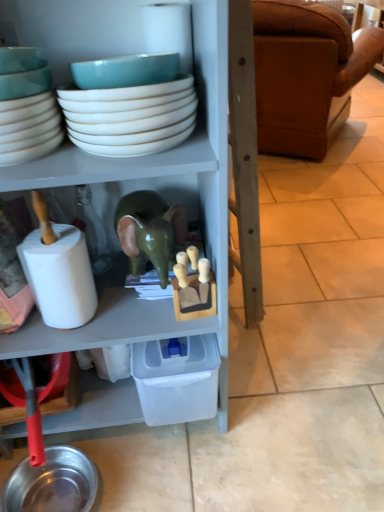
Where is `brown leather couch at right`? brown leather couch at right is located at coordinates (306, 74).

Identify the location of metallic silver bowl at lower left. (52, 483).

What do you see at coordinates (29, 128) in the screenshot? I see `teal ceramic bowl at upper left, marked as the 1th bowl in a left-to-right arrangement` at bounding box center [29, 128].

Where is `teal ceramic bowl at upper left, marked as the 2th bowl in a right-to-left arrangement`? The width and height of the screenshot is (384, 512). teal ceramic bowl at upper left, marked as the 2th bowl in a right-to-left arrangement is located at coordinates (29, 128).

I want to click on green glossy elephant at center, so click(150, 229).

What do you see at coordinates (60, 276) in the screenshot? The image size is (384, 512). I see `white matte toilet paper at left` at bounding box center [60, 276].

The width and height of the screenshot is (384, 512). Identify the location of white glossy bowls at upper center, the 1th bowl when ordered from right to left. 130,117.

Is white matte toilet paper at left wider or thinner than metallic silver bowl at lower left?

Clearly, white matte toilet paper at left has less width compared to metallic silver bowl at lower left.

Does white matte toilet paper at left touch metallic silver bowl at lower left?

white matte toilet paper at left and metallic silver bowl at lower left are clearly separated.

From a real-world perspective, which is physically below, white matte toilet paper at left or metallic silver bowl at lower left?

metallic silver bowl at lower left, from a real-world perspective.

Is green glossy elephant at center turned away from brown leather couch at right?

No, green glossy elephant at center is not facing away from brown leather couch at right.

Would you say green glossy elephant at center is to the left or to the right of brown leather couch at right in the picture?

In the image, green glossy elephant at center appears on the left side of brown leather couch at right.

Is green glossy elephant at center far from brown leather couch at right?

Yes, green glossy elephant at center and brown leather couch at right are located far from each other.

Who is more distant, green glossy elephant at center or brown leather couch at right?

Positioned behind is brown leather couch at right.

From a real-world perspective, who is located lower, white matte toilet paper at left or white glossy bowls at upper center, which is the 2th bowl in left-to-right order?

white matte toilet paper at left is physically lower.

Considering the sizes of objects white matte toilet paper at left and white glossy bowls at upper center, the 1th bowl when ordered from right to left, in the image provided, who is smaller, white matte toilet paper at left or white glossy bowls at upper center, the 1th bowl when ordered from right to left,?

white matte toilet paper at left is smaller.

What's the angular difference between white matte toilet paper at left and white glossy bowls at upper center, which is the 2th bowl in left-to-right order,'s facing directions?

The angle between the facing direction of white matte toilet paper at left and the facing direction of white glossy bowls at upper center, which is the 2th bowl in left-to-right order, is 3.2 degrees.

Is there a large distance between white matte toilet paper at left and white glossy bowls at upper center, the 1th bowl when ordered from right to left?

They are positioned close to each other.

Is green glossy elephant at center turned away from white matte toilet paper at left?

No.

Considering the sizes of objects green glossy elephant at center and white matte toilet paper at left in the image provided, who is bigger, green glossy elephant at center or white matte toilet paper at left?

green glossy elephant at center is bigger.

Does point (125, 219) come behind point (37, 294)?

No.

How different are the orientations of green glossy elephant at center and white matte toilet paper at left in degrees?

green glossy elephant at center and white matte toilet paper at left are facing 0.000566 degrees away from each other.

From a real-world perspective, is green glossy elephant at center on white glossy bowls at upper center, the 1th bowl when ordered from right to left?

No, from a real-world perspective, green glossy elephant at center is not above white glossy bowls at upper center, the 1th bowl when ordered from right to left.

Can you confirm if green glossy elephant at center is shorter than white glossy bowls at upper center, the 1th bowl when ordered from right to left?

In fact, green glossy elephant at center may be taller than white glossy bowls at upper center, the 1th bowl when ordered from right to left.

Considering the points (126, 205) and (108, 153), which point is behind, point (126, 205) or point (108, 153)?

Point (126, 205)

Is green glossy elephant at center in contact with teal ceramic bowl at upper left, marked as the 2th bowl in a right-to-left arrangement?

green glossy elephant at center and teal ceramic bowl at upper left, marked as the 2th bowl in a right-to-left arrangement, are clearly separated.

Considering the sizes of objects green glossy elephant at center and teal ceramic bowl at upper left, marked as the 2th bowl in a right-to-left arrangement, in the image provided, who is smaller, green glossy elephant at center or teal ceramic bowl at upper left, marked as the 2th bowl in a right-to-left arrangement,?

teal ceramic bowl at upper left, marked as the 2th bowl in a right-to-left arrangement, is smaller.

Is green glossy elephant at center wider than teal ceramic bowl at upper left, marked as the 1th bowl in a left-to-right arrangement?

Correct, the width of green glossy elephant at center exceeds that of teal ceramic bowl at upper left, marked as the 1th bowl in a left-to-right arrangement.

Is green glossy elephant at center facing away from teal ceramic bowl at upper left, marked as the 1th bowl in a left-to-right arrangement?

No, green glossy elephant at center's orientation is not away from teal ceramic bowl at upper left, marked as the 1th bowl in a left-to-right arrangement.

From the image's perspective, which is below, white matte toilet paper at left or green glossy elephant at center?

From the image's view, white matte toilet paper at left is below.

Locate an element on the screen. toilet paper on the left of green glossy elephant at center is located at coordinates (60, 276).

Considering the relative positions of white matte toilet paper at left and green glossy elephant at center in the image provided, is white matte toilet paper at left to the right of green glossy elephant at center from the viewer's perspective?

No, white matte toilet paper at left is not to the right of green glossy elephant at center.

Considering the sizes of objects white matte toilet paper at left and green glossy elephant at center in the image provided, who is shorter, white matte toilet paper at left or green glossy elephant at center?

green glossy elephant at center is shorter.

This screenshot has width=384, height=512. What are the coordinates of `tableware behind the white matte toilet paper at left` in the screenshot? It's located at (52, 483).

This screenshot has height=512, width=384. I want to click on studio couch that appears on the right of green glossy elephant at center, so click(x=306, y=74).

From the picture: Estimate the real-world distances between objects in this image. Which object is further from white glossy bowls at upper center, which is the 2th bowl in left-to-right order, brown leather couch at right or metallic silver bowl at lower left?

Based on the image, brown leather couch at right appears to be further to white glossy bowls at upper center, which is the 2th bowl in left-to-right order.

Which object lies further to the anchor point metallic silver bowl at lower left, brown leather couch at right or green glossy elephant at center?

brown leather couch at right is positioned further to the anchor metallic silver bowl at lower left.

Considering their positions, is white glossy bowls at upper center, the 1th bowl when ordered from right to left, positioned further to white matte toilet paper at left than teal ceramic bowl at upper left, marked as the 1th bowl in a left-to-right arrangement?

Among the two, white glossy bowls at upper center, the 1th bowl when ordered from right to left, is located further to white matte toilet paper at left.

Looking at the image, which one is located further to green glossy elephant at center, teal ceramic bowl at upper left, marked as the 1th bowl in a left-to-right arrangement, or metallic silver bowl at lower left?

Based on the image, metallic silver bowl at lower left appears to be further to green glossy elephant at center.

Considering their positions, is white matte toilet paper at left positioned closer to brown leather couch at right than metallic silver bowl at lower left?

white matte toilet paper at left is positioned closer to the anchor brown leather couch at right.

Based on their spatial positions, is green glossy elephant at center or metallic silver bowl at lower left further from brown leather couch at right?

The object further to brown leather couch at right is metallic silver bowl at lower left.

Looking at the image, which one is located closer to metallic silver bowl at lower left, green glossy elephant at center or brown leather couch at right?

Based on the image, green glossy elephant at center appears to be nearer to metallic silver bowl at lower left.

Considering their positions, is brown leather couch at right positioned closer to white matte toilet paper at left than teal ceramic bowl at upper left, marked as the 1th bowl in a left-to-right arrangement?

teal ceramic bowl at upper left, marked as the 1th bowl in a left-to-right arrangement, lies closer to white matte toilet paper at left than the other object.

I want to click on toilet paper between teal ceramic bowl at upper left, marked as the 1th bowl in a left-to-right arrangement, and metallic silver bowl at lower left vertically, so click(x=60, y=276).

You are a GUI agent. You are given a task and a screenshot of the screen. Output one action in this format:
    pyautogui.click(x=<x>, y=<y>)
    Task: Click on the toy between white glossy bowls at upper center, the 1th bowl when ordered from right to left, and white matte toilet paper at left in the up-down direction
    
    Given the screenshot: What is the action you would take?
    pyautogui.click(x=150, y=229)

Identify the location of toy between white glossy bowls at upper center, which is the 2th bowl in left-to-right order, and metallic silver bowl at lower left vertically. click(150, 229).

Identify the location of toilet paper that lies between brown leather couch at right and metallic silver bowl at lower left from top to bottom. The image size is (384, 512). (60, 276).